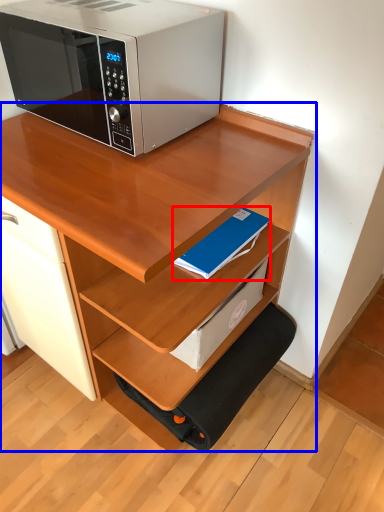
Question: Which of the following is the farthest to the observer, paperback book (highlighted by a red box) or desk (highlighted by a blue box)?

Choices:
 (A) paperback book
 (B) desk

Answer: (A)